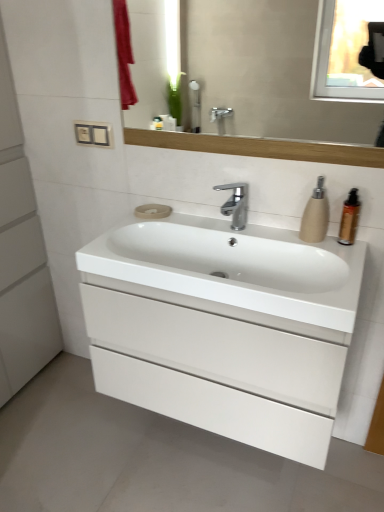
Locate an element on the screen. Image resolution: width=384 pixels, height=512 pixels. vacant space underneath white glossy cabinet at center (from a real-world perspective) is located at coordinates (222, 455).